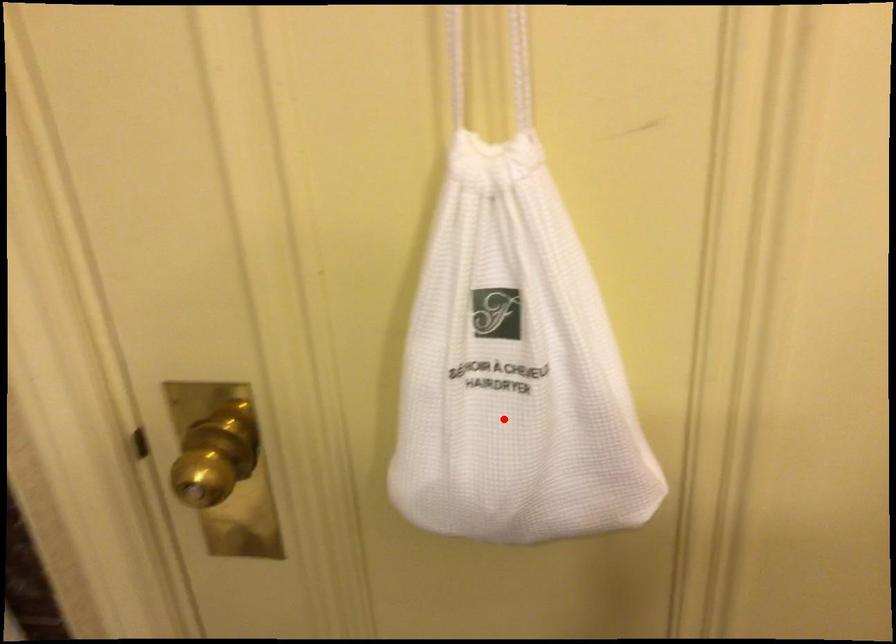
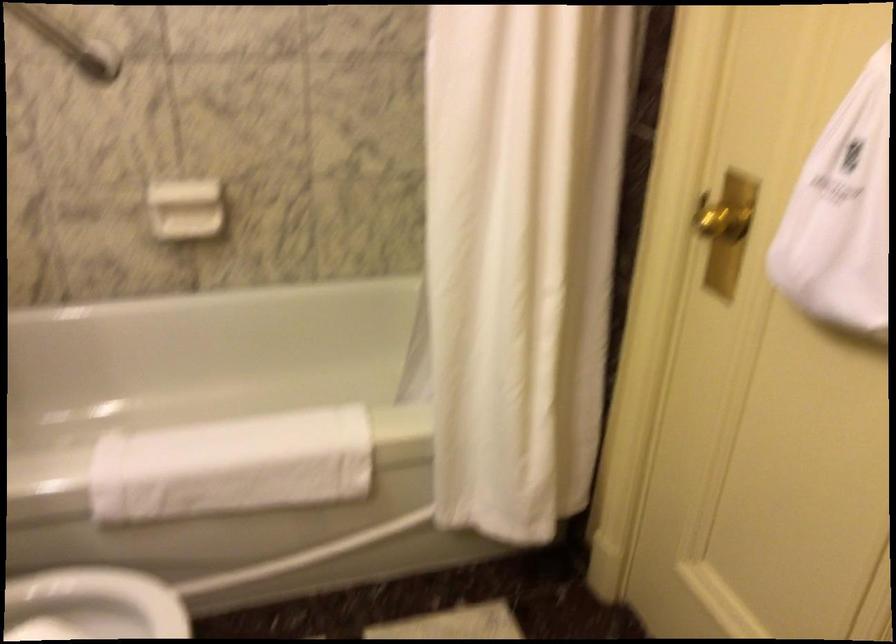
Question: I am providing you with two images of the same scene from different viewpoints. In image1, a red point is highlighted. Considering the same 3D point in image2, which of the following is correct?

Choices:
 (A) It is closer
 (B) It is farther

Answer: (B)